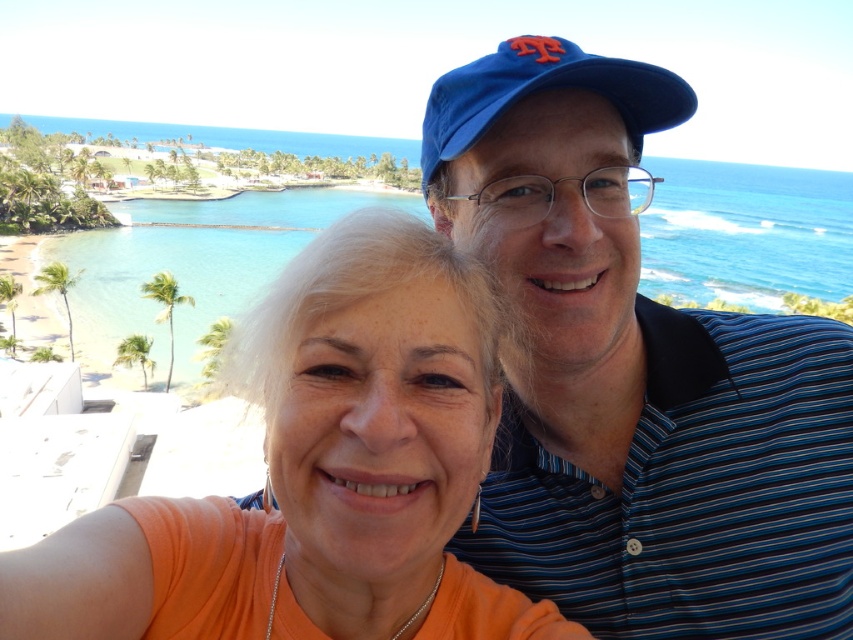
Can you confirm if blue striped polo shirt at upper right is positioned above orange matte shirt at center?

Indeed, blue striped polo shirt at upper right is positioned over orange matte shirt at center.

Can you confirm if blue striped polo shirt at upper right is positioned to the left of orange matte shirt at center?

In fact, blue striped polo shirt at upper right is to the right of orange matte shirt at center.

Between point (598, 536) and point (381, 317), which one is positioned in front?

Positioned in front is point (381, 317).

Identify the location of blue striped polo shirt at upper right. (634, 376).

Is blue striped polo shirt at upper right thinner than blue fabric baseball cap at upper center?

Indeed, blue striped polo shirt at upper right has a lesser width compared to blue fabric baseball cap at upper center.

The width and height of the screenshot is (853, 640). What are the coordinates of `blue striped polo shirt at upper right` in the screenshot? It's located at (634, 376).

Is the position of orange matte shirt at center more distant than that of clear blue water at center?

No, it is not.

Is point (422, 221) positioned behind point (218, 300)?

No, it is not.

Where is `orange matte shirt at center`? orange matte shirt at center is located at coordinates (318, 474).